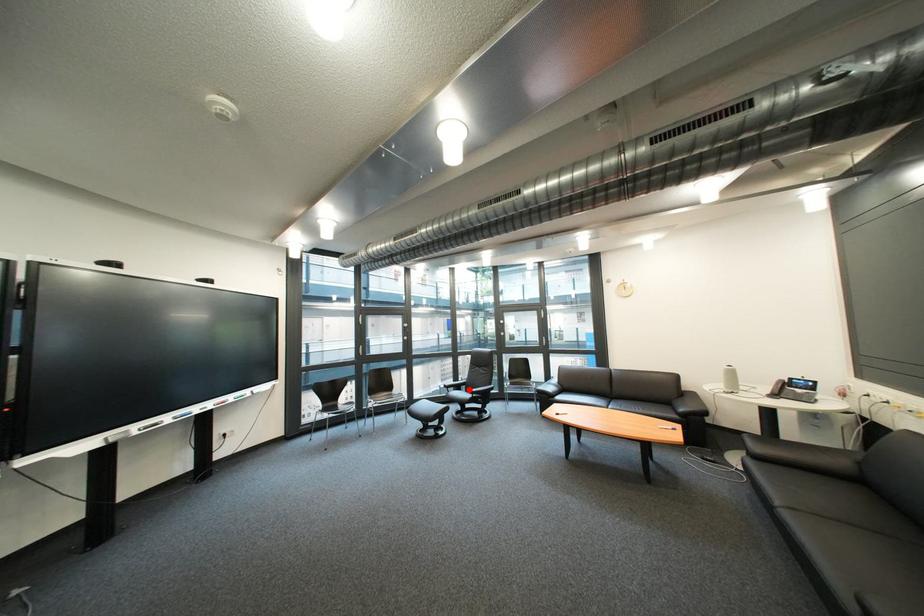
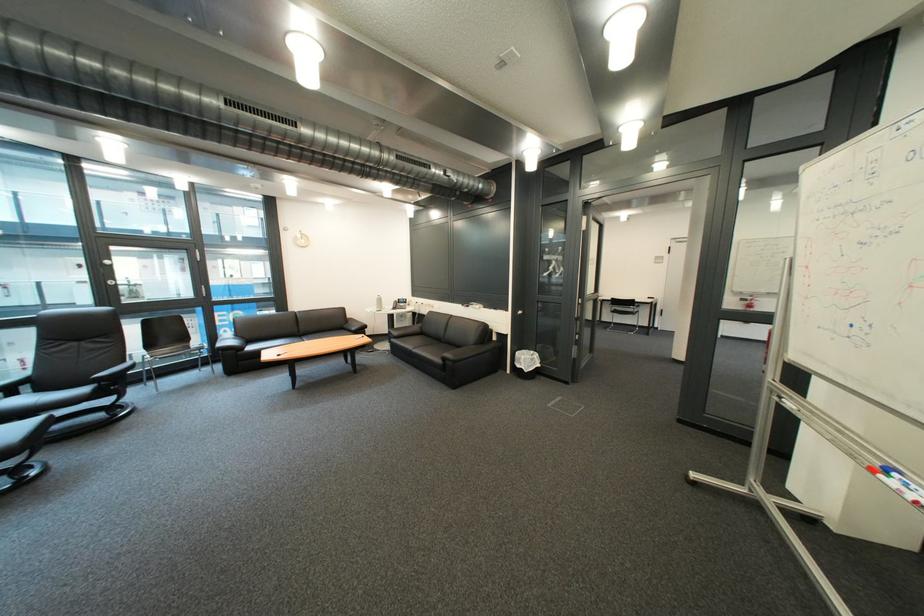
Find the pixel in the second image that matches the highlighted location in the first image.

(16, 395)